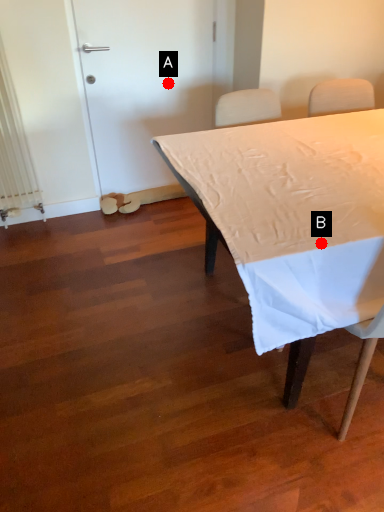
Question: Two points are circled on the image, labeled by A and B beside each circle. Which point is closer to the camera?

Choices:
 (A) A is closer
 (B) B is closer

Answer: (B)